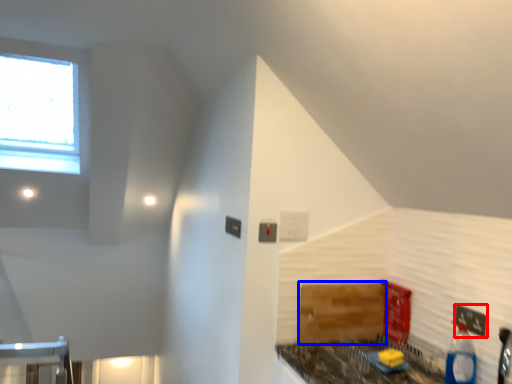
Question: Among these objects, which one is farthest to the camera, electric outlet (highlighted by a red box) or cabinetry (highlighted by a blue box)?

Choices:
 (A) electric outlet
 (B) cabinetry

Answer: (B)